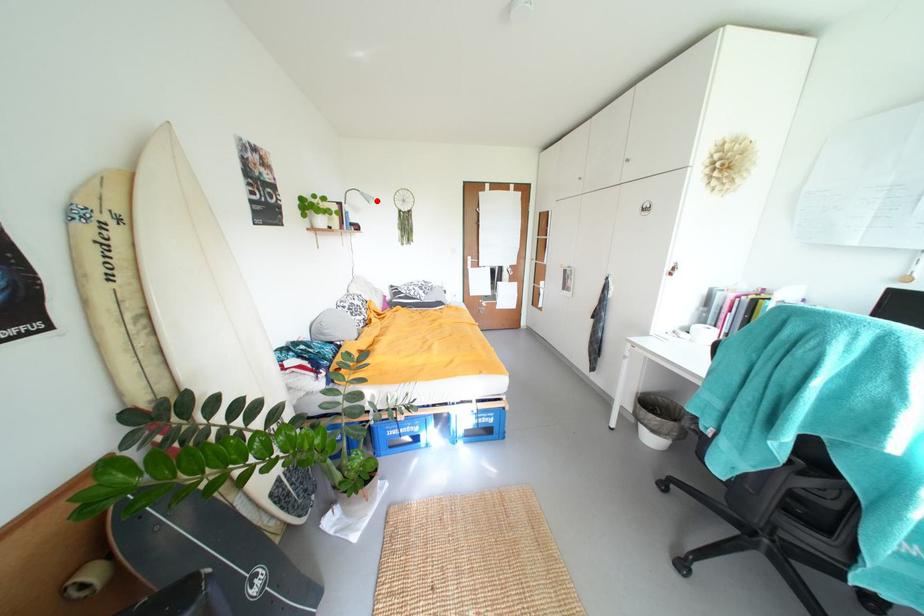
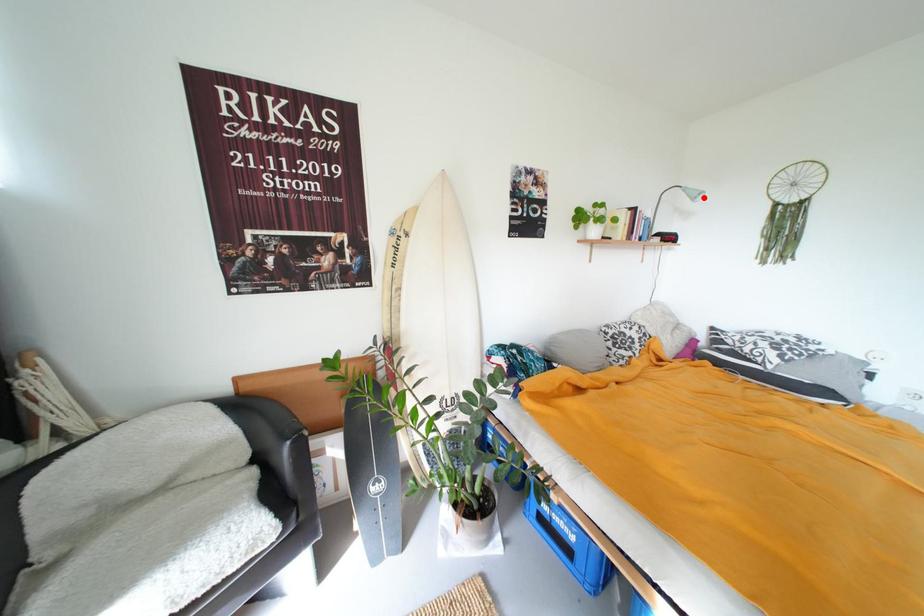
Based on the photo, I am providing you with two images of the same scene from different viewpoints. A red point is marked on the first image and another point is marked on the second image. Is the red point in image1 aligned with the point shown in image2?

Yes